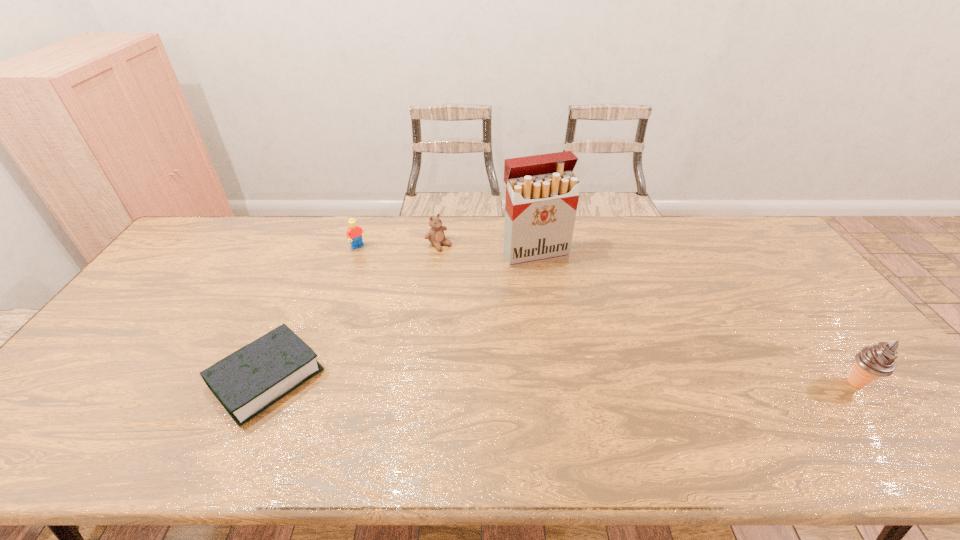
Where is `vacant space located 0.240m on the front-facing side of the teddy bear`? The height and width of the screenshot is (540, 960). vacant space located 0.240m on the front-facing side of the teddy bear is located at coordinates (494, 286).

This screenshot has width=960, height=540. I want to click on vacant space situated on the front-facing side of the teddy bear, so click(519, 305).

Locate an element on the screen. This screenshot has height=540, width=960. vacant space located 0.210m with the lid open on the tallest object is located at coordinates 574,311.

Locate an element on the screen. free space located 0.140m with the lid open on the tallest object is located at coordinates (564, 295).

The height and width of the screenshot is (540, 960). I want to click on free space located 0.350m with the lid open on the tallest object, so click(596, 347).

Where is `free space located on the face of the Lego`? free space located on the face of the Lego is located at coordinates (372, 262).

Identify the location of free space located 0.050m on the face of the Lego. (370, 259).

Locate an element on the screen. vacant space located 0.400m on the face of the Lego is located at coordinates (423, 321).

At what (x,y) coordinates should I click in order to perform the action: click on teddy bear at the far edge. Please return your answer as a coordinate pair (x, y). Image resolution: width=960 pixels, height=540 pixels. Looking at the image, I should click on (435, 235).

At what (x,y) coordinates should I click in order to perform the action: click on cigarette case that is at the far edge. Please return your answer as a coordinate pair (x, y). Looking at the image, I should click on (542, 193).